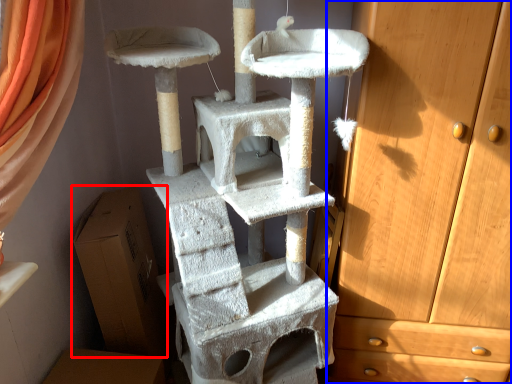
Question: Which object appears closest to the camera in this image, cardboard box (highlighted by a red box) or chest of drawers (highlighted by a blue box)?

Choices:
 (A) cardboard box
 (B) chest of drawers

Answer: (B)